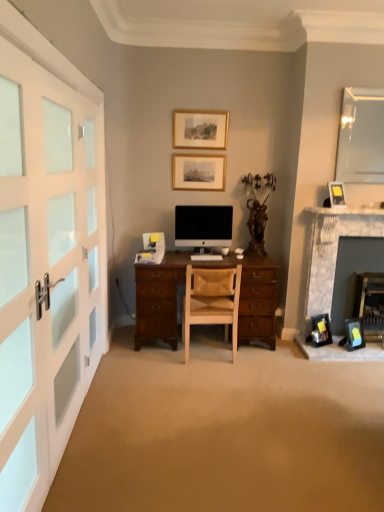
Question: Is matte black picture frame at lower right, which appears as the 2th picture frame when ordered from the bottom, inside or outside of white frosted glass doors at left?

Choices:
 (A) inside
 (B) outside

Answer: (B)

Question: Based on their positions, is matte black picture frame at lower right, which is the fourth picture frame from top to bottom, located to the left or right of white frosted glass doors at left?

Choices:
 (A) right
 (B) left

Answer: (A)

Question: Estimate the real-world distances between objects in this image. Which object is farther from the matte gold picture frame at upper right, which is the 3th picture frame in bottom-to-top order?

Choices:
 (A) matte gold picture frame at upper center, which ranks as the fifth picture frame in right-to-left order
 (B) white plastic keyboard at center
 (C) white marble fireplace at right
 (D) matte black picture frame at lower right, the 5th picture frame viewed from the left
 (E) leather at center

Answer: (E)

Question: Which of these objects is positioned closest to the matte black picture frame at lower right, the 5th picture frame viewed from the left?

Choices:
 (A) leather at center
 (B) matte gold picture frame at upper right, positioned as the 2th picture frame in right-to-left order
 (C) white plastic keyboard at center
 (D) matte black picture frame at lower right, the 3th picture frame positioned from the right
 (E) matte gold picture frame at upper center, which is the 1th picture frame from left to right

Answer: (D)